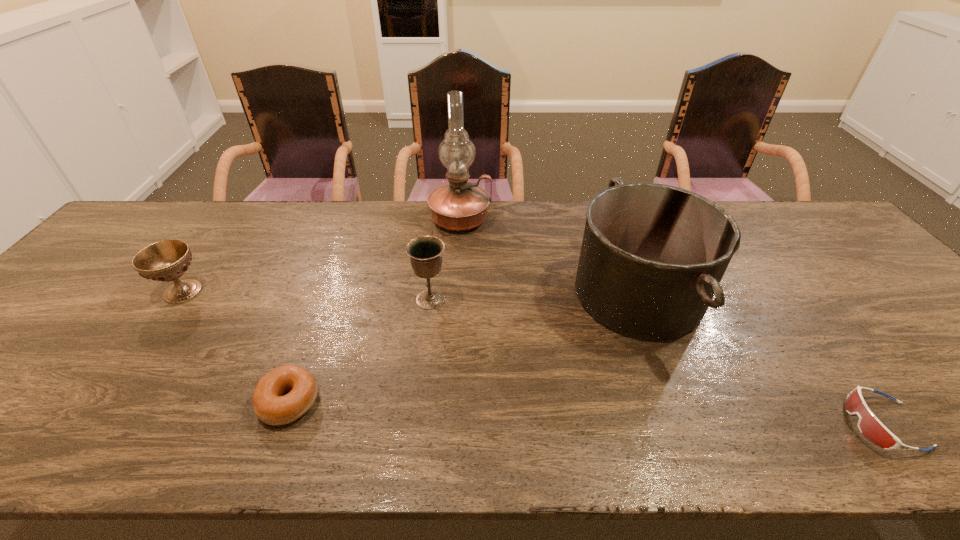
This screenshot has width=960, height=540. I want to click on blank space located on the right of the farthest object, so click(528, 219).

Where is `free spot located 0.210m on the right of the fifth object from left to right`? free spot located 0.210m on the right of the fifth object from left to right is located at coordinates (781, 294).

You are a GUI agent. You are given a task and a screenshot of the screen. Output one action in this format:
    pyautogui.click(x=<x>, y=<y>)
    Task: Click on the free space located on the right of the fourth shortest object
    The image size is (960, 540).
    Given the screenshot: What is the action you would take?
    pyautogui.click(x=475, y=299)

Where is `free spot located on the front of the leftmost object`? The height and width of the screenshot is (540, 960). free spot located on the front of the leftmost object is located at coordinates (98, 410).

Identify the location of free point located on the right of the bagel. The width and height of the screenshot is (960, 540). (433, 402).

At what (x,y) coordinates should I click in order to perform the action: click on vacant space located 0.090m on the front-facing side of the goggles. Please return your answer as a coordinate pair (x, y). The width and height of the screenshot is (960, 540). Looking at the image, I should click on (804, 424).

Image resolution: width=960 pixels, height=540 pixels. I want to click on vacant space located on the front-facing side of the goggles, so click(x=783, y=424).

Identify the location of vacant space located on the front-facing side of the goggles. The image size is (960, 540). (679, 424).

The width and height of the screenshot is (960, 540). Identify the location of oil lamp that is at the far edge. (460, 206).

The height and width of the screenshot is (540, 960). Identify the location of pan that is at the far edge. (653, 255).